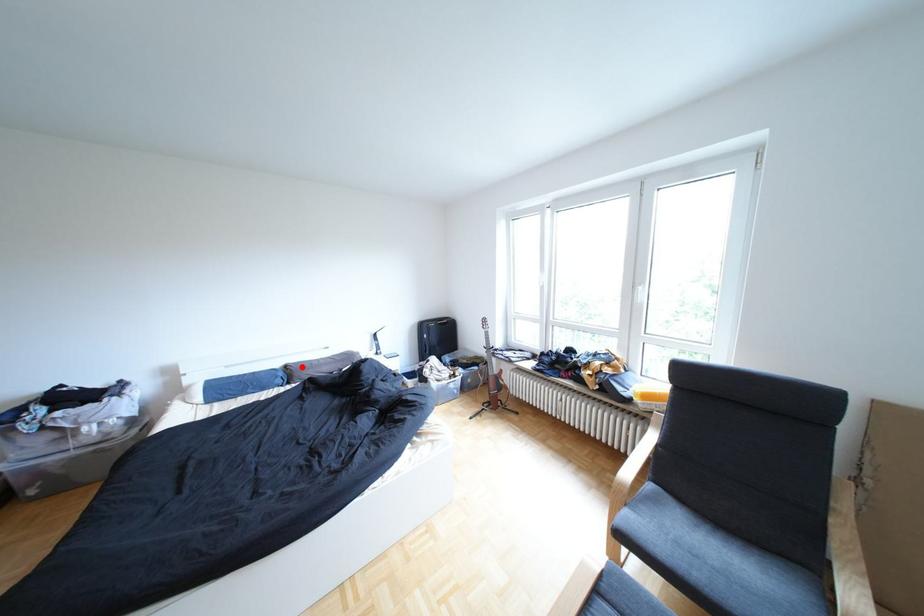
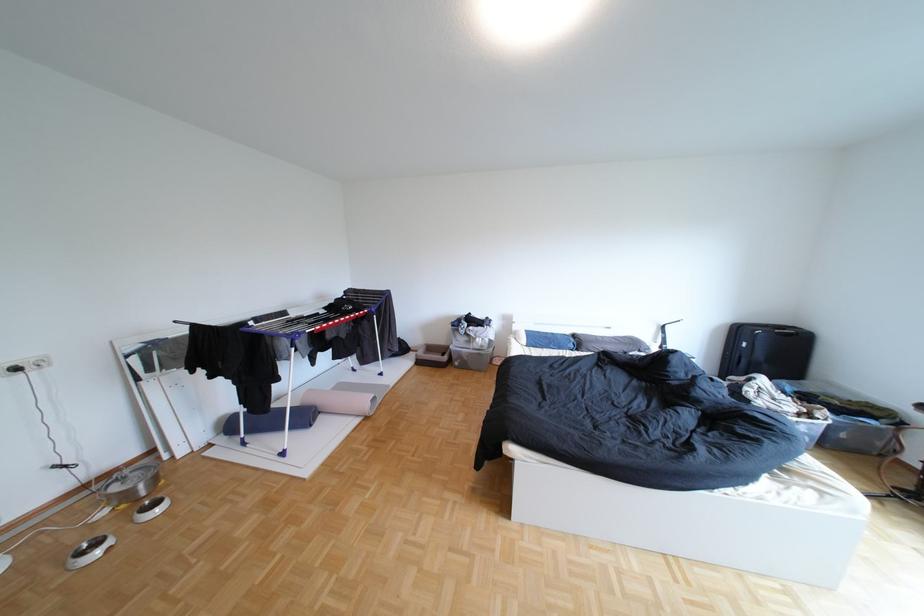
Find the pixel in the second image that matches the highlighted location in the first image.

(590, 336)